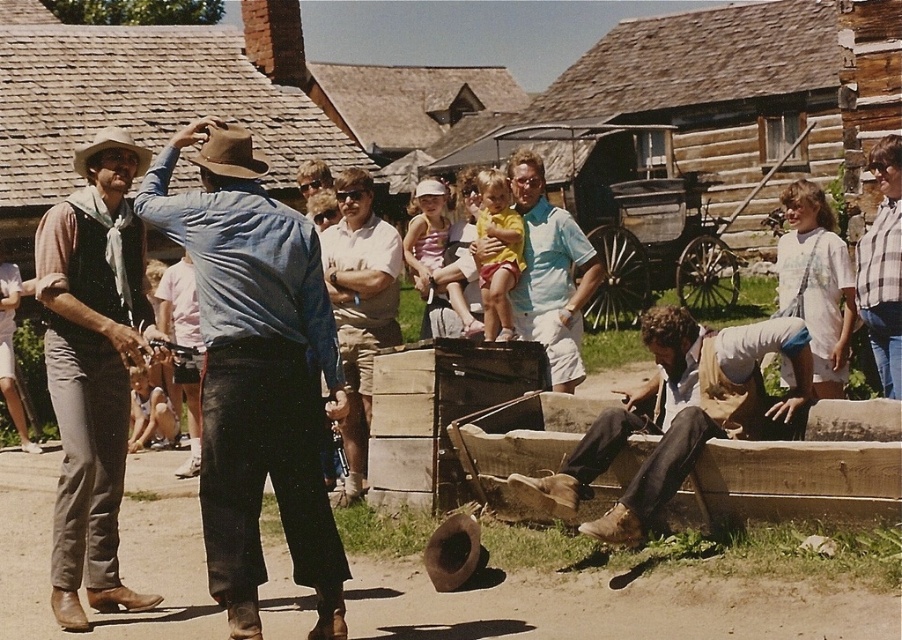
You are a photographer trying to capture a candid shot of the light brown leather boots at center and the brown felt cowboy hat at upper left. Which object is positioned more to the left in the image?

The brown felt cowboy hat at upper left is positioned more to the left than the light brown leather boots at center.

Based on the photo, you are a photographer at the historical reenactment. You want to capture a photo where the wooden wagon at center is clearly visible above the light blue cotton shirt at center. Based on their positions, is this possible?

Yes, the wooden wagon at center is already positioned above the light blue cotton shirt at center, so capturing such a photo is possible.